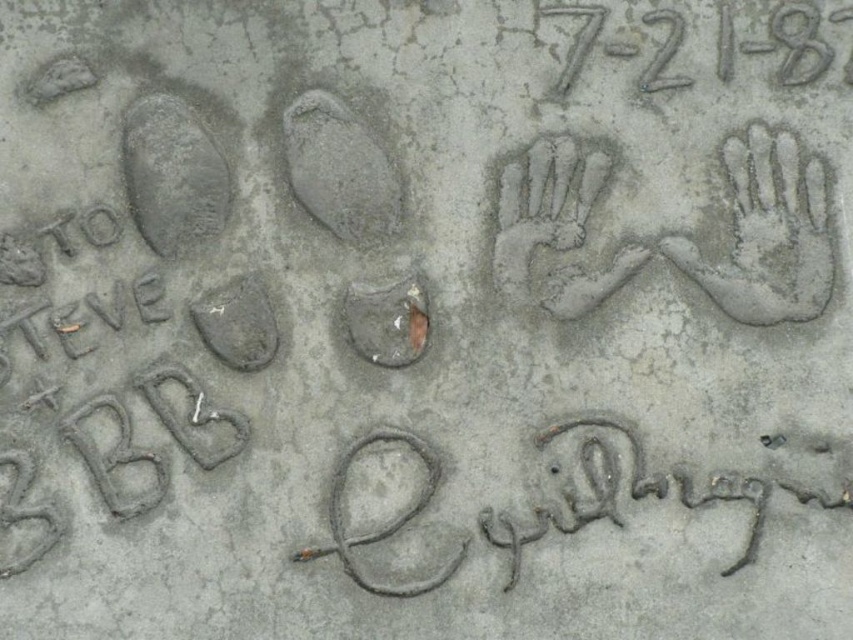
You are standing on the concrete surface and want to move from the point at coordinates point (x=321, y=212) to the point at coordinates point (x=407, y=364). Which direction should you face to walk towards the second point?

You should face forward because point (x=321, y=212) is behind point (x=407, y=364), so moving forward from point (x=321, y=212) will take you toward point (x=407, y=364).

You are an archaeologist examining the concrete surface. You notice the gray concrete footprint at upper left and the smooth concrete footprint at center. Which footprint is positioned higher up on the concrete surface?

The gray concrete footprint at upper left is positioned higher up on the concrete surface than the smooth concrete footprint at center.